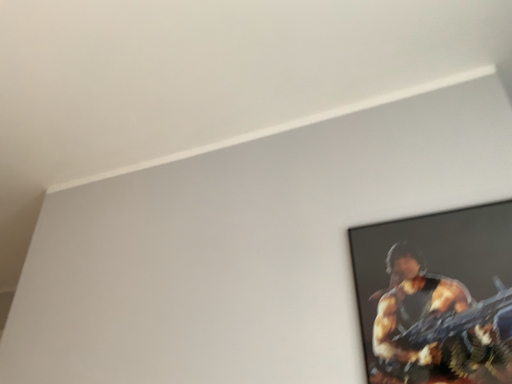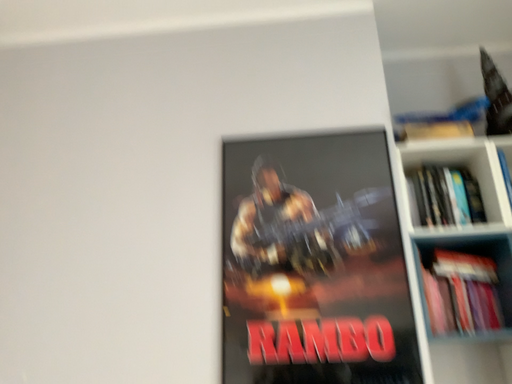
Question: Which way did the camera rotate in the video?

Choices:
 (A) rotated right
 (B) rotated left

Answer: (A)